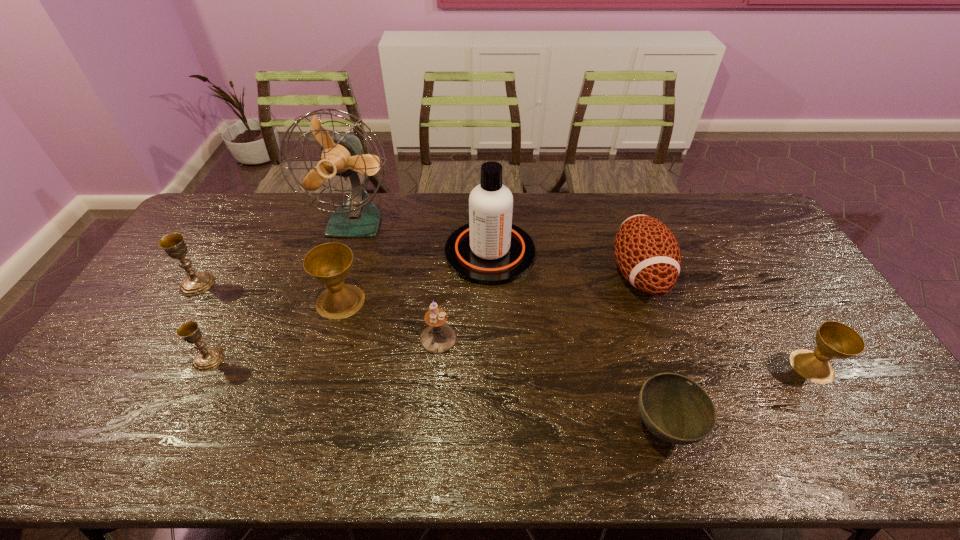
The width and height of the screenshot is (960, 540). In order to click on the right gold chalice in this screenshot , I will do `click(208, 359)`.

I want to click on the eighth object from right to left, so click(208, 359).

This screenshot has width=960, height=540. In order to click on the rightmost chalice in this screenshot , I will do `click(836, 340)`.

Locate an element on the screen. The height and width of the screenshot is (540, 960). the nearer brown chalice is located at coordinates click(836, 340).

Find the location of `bowl`. bowl is located at coordinates (676, 409).

You are a GUI agent. You are given a task and a screenshot of the screen. Output one action in this format:
    pyautogui.click(x=<x>, y=<y>)
    Task: Click on the shortest object
    The height and width of the screenshot is (540, 960).
    Given the screenshot: What is the action you would take?
    pyautogui.click(x=676, y=409)

Find the location of `vacant area situated on the front-facing side of the tallest object for air flow`. vacant area situated on the front-facing side of the tallest object for air flow is located at coordinates (338, 278).

I want to click on free point located 0.270m on the front of the white cleansing agent, so click(x=492, y=358).

Locate an element on the screen. The width and height of the screenshot is (960, 540). blank space located on the front of the football is located at coordinates pos(688,415).

Find the location of `vacant space located 0.280m on the back of the farther gold chalice`. vacant space located 0.280m on the back of the farther gold chalice is located at coordinates (238, 218).